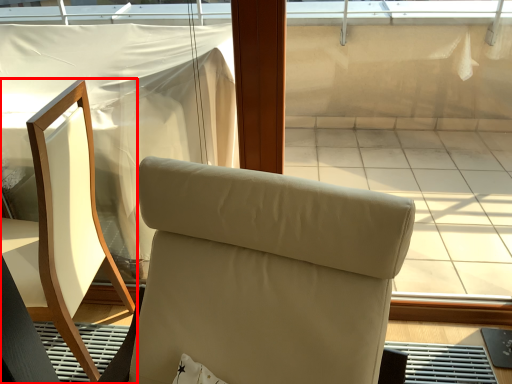
Question: Where is chair (annotated by the red box) located in relation to chair in the image?

Choices:
 (A) left
 (B) right

Answer: (A)